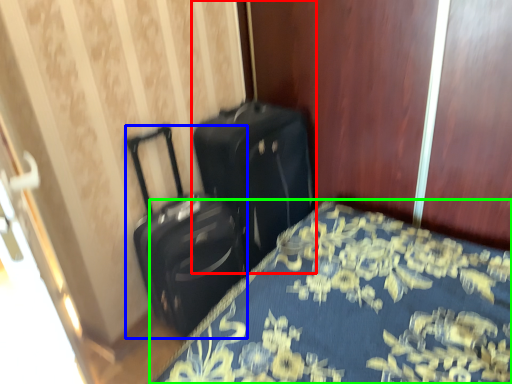
Question: Which is nearer to the suitcase (highlighted by a red box)? suitcase (highlighted by a blue box) or bed (highlighted by a green box).

Choices:
 (A) suitcase
 (B) bed

Answer: (A)